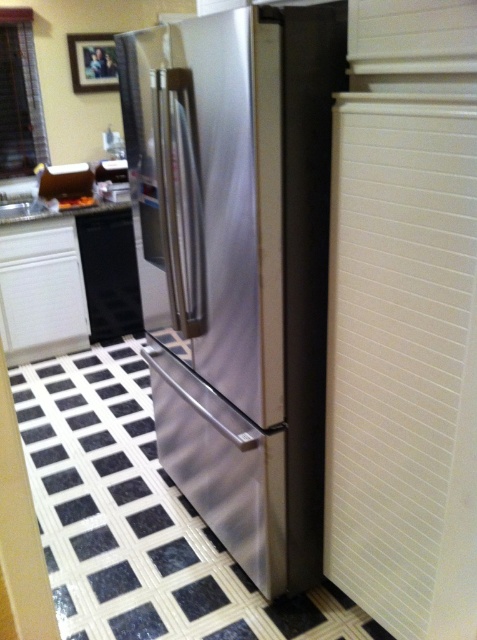
Can you confirm if stainless steel refrigerator at center is taller than black matte dishwasher at lower left?

Indeed, stainless steel refrigerator at center has a greater height compared to black matte dishwasher at lower left.

Where is `stainless steel refrigerator at center`? The width and height of the screenshot is (477, 640). stainless steel refrigerator at center is located at coordinates (238, 266).

You are a GUI agent. You are given a task and a screenshot of the screen. Output one action in this format:
    pyautogui.click(x=<x>, y=<y>)
    Task: Click on the stainless steel refrigerator at center
    
    Given the screenshot: What is the action you would take?
    pyautogui.click(x=238, y=266)